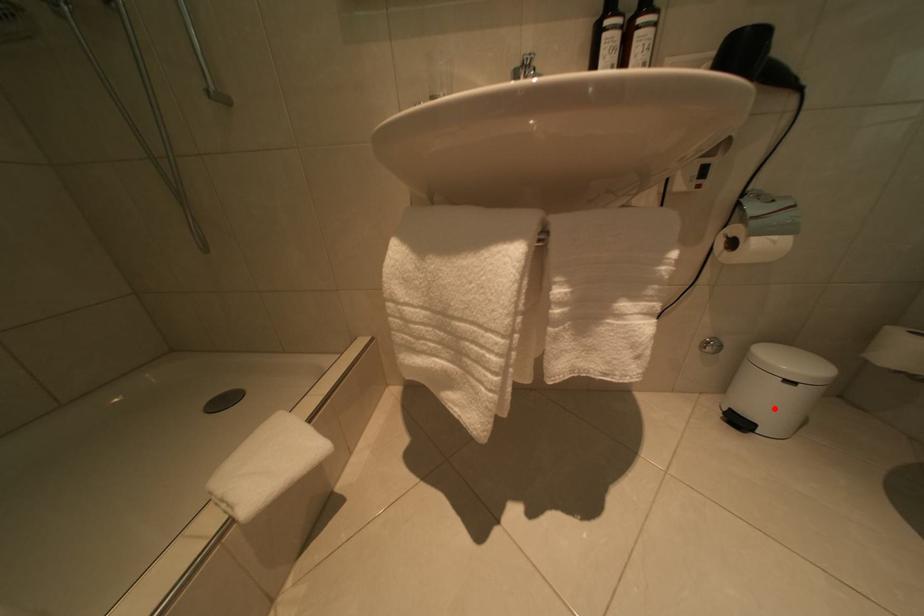
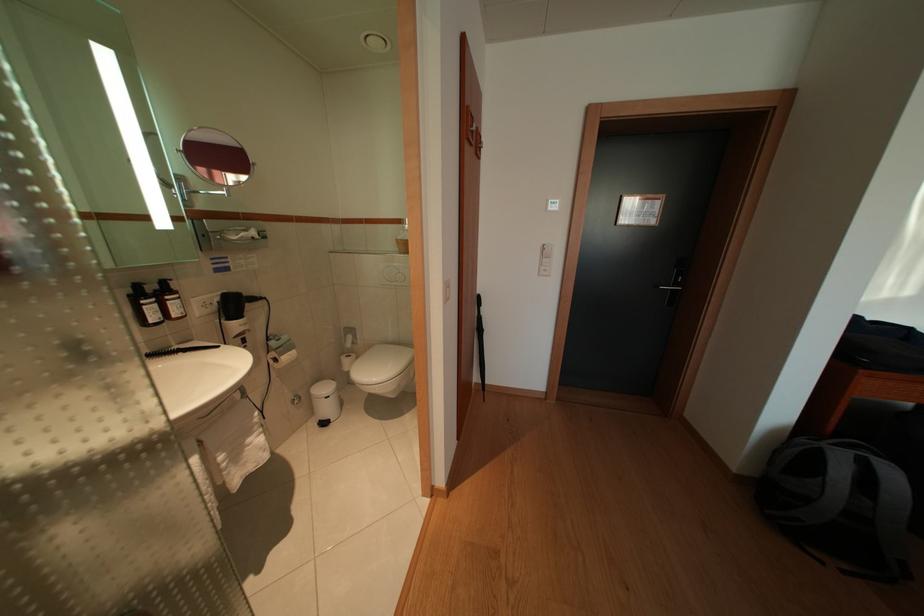
Question: A red point is marked in image1. In image2, is the corresponding 3D point closer to the camera or farther? Reply with the corresponding letter.

Choices:
 (A) The corresponding 3D point is closer.
 (B) The corresponding 3D point is farther.

Answer: (B)